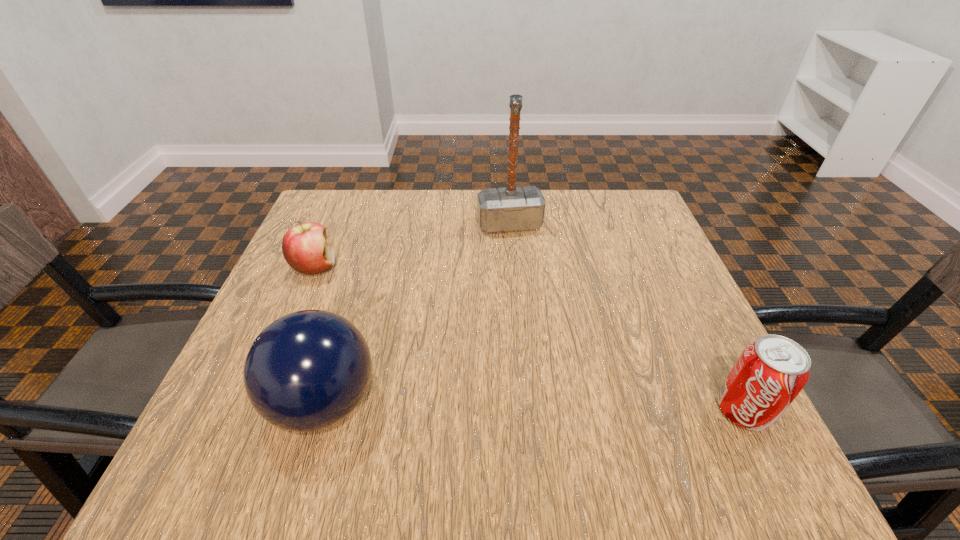
Find the location of `bowling ball`. bowling ball is located at coordinates (308, 370).

What are the coordinates of `the rightmost object` in the screenshot? It's located at (769, 374).

Locate an element on the screen. Image resolution: width=960 pixels, height=540 pixels. the third tallest object is located at coordinates (769, 374).

Locate an element on the screen. the shortest object is located at coordinates (305, 247).

Locate an element on the screen. The width and height of the screenshot is (960, 540). the second farthest object is located at coordinates (305, 247).

Find the location of a particular element. the third object from left to right is located at coordinates (512, 208).

Identify the location of hammer. This screenshot has width=960, height=540. (512, 208).

Locate an element on the screen. This screenshot has width=960, height=540. blank area located 0.060m on the surface of the bowling ball near the finger holes is located at coordinates (234, 403).

Identify the location of free location located 0.130m on the back of the second shortest object. This screenshot has height=540, width=960. (704, 332).

Where is `free location located 0.110m on the bitten side of the shortest object`? The image size is (960, 540). free location located 0.110m on the bitten side of the shortest object is located at coordinates (366, 295).